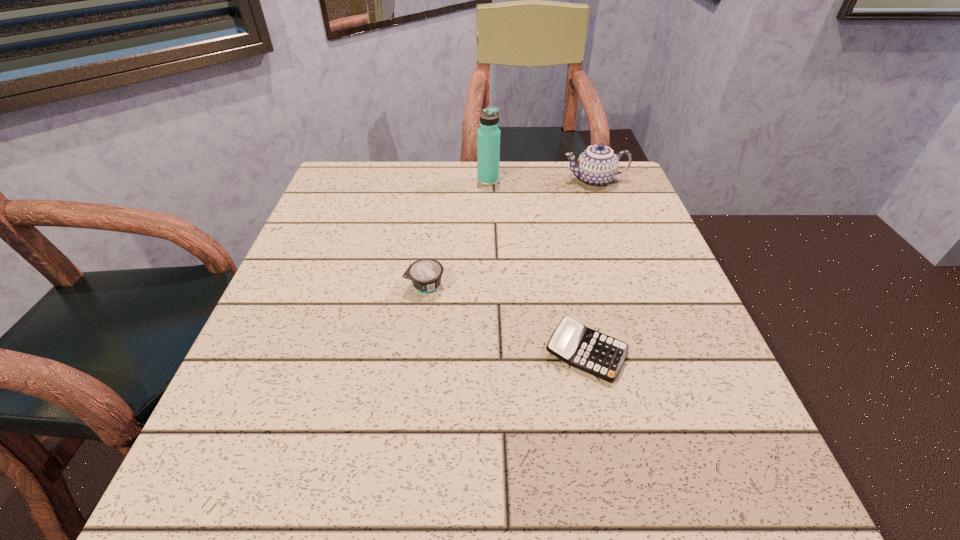
Locate an element on the screen. vacant space at the right edge is located at coordinates (693, 420).

In the image, there is a desktop. In order to click on vacant space at the far left corner in this screenshot , I will do `click(368, 178)`.

Find the location of a particular element. vacant space at the near left corner is located at coordinates (279, 469).

What are the coordinates of `vacant area at the far right corner` in the screenshot? It's located at (567, 164).

This screenshot has width=960, height=540. Find the location of `free space between the shortest object and the tallest object`. free space between the shortest object and the tallest object is located at coordinates (537, 267).

The height and width of the screenshot is (540, 960). I want to click on free area in between the chinaware and the tallest object, so click(541, 180).

The height and width of the screenshot is (540, 960). I want to click on empty space between the third object from right to left and the chinaware, so click(x=541, y=180).

Identify the location of empty location between the third shortest object and the nearest object. The width and height of the screenshot is (960, 540). (590, 266).

This screenshot has width=960, height=540. Identify the location of free space between the calculator and the tallest object. (537, 267).

The width and height of the screenshot is (960, 540). Find the location of `vacant space that is in between the shortest object and the tallest object`. vacant space that is in between the shortest object and the tallest object is located at coordinates pos(537,267).